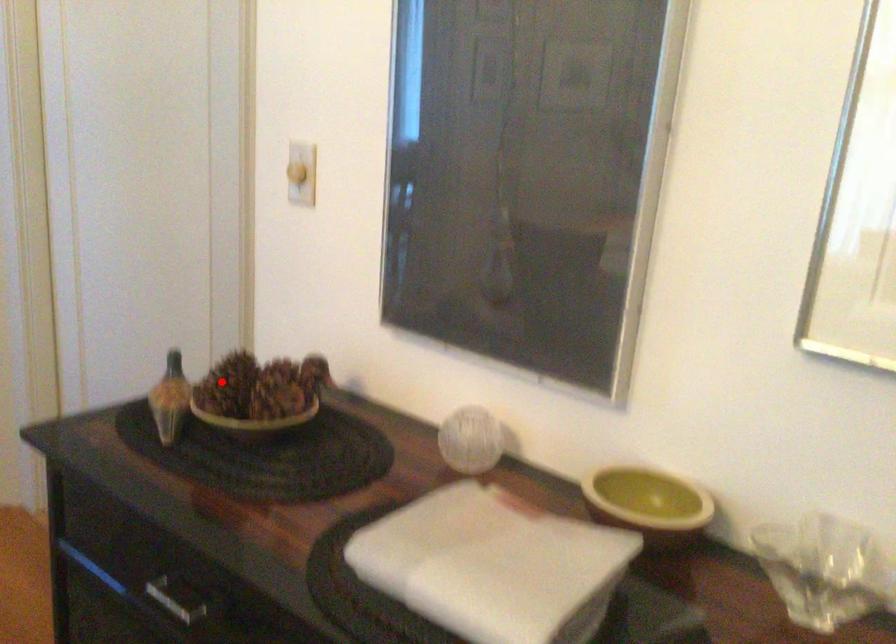
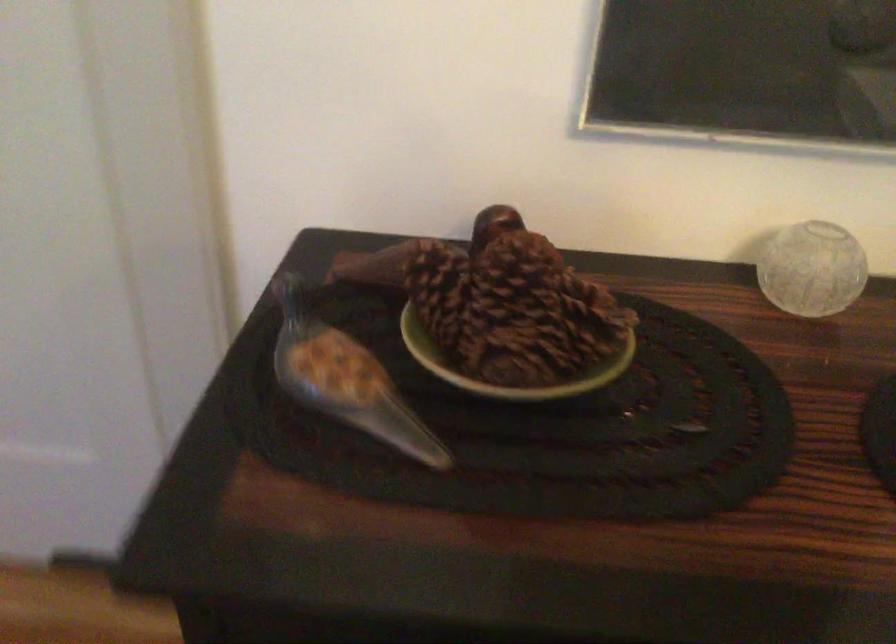
Question: I am providing you with two images of the same scene from different viewpoints. In image1, a red point is highlighted. Considering the same 3D point in image2, which of the following is correct?

Choices:
 (A) It is closer
 (B) It is farther

Answer: (A)